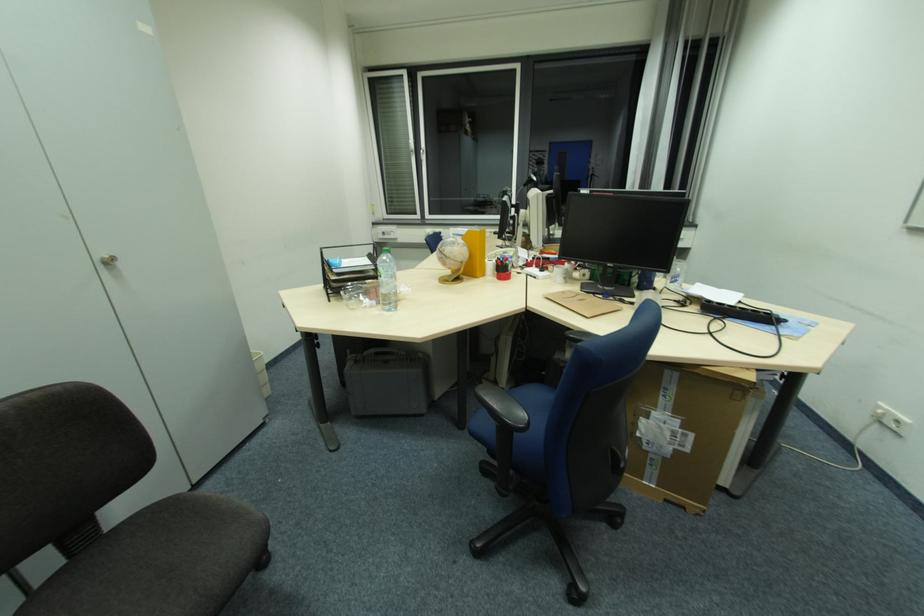
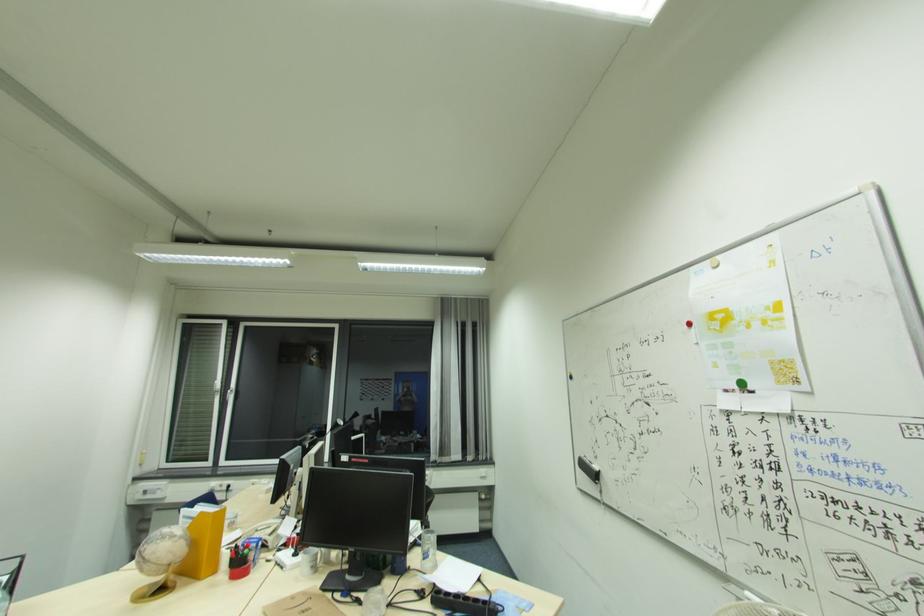
In the second image, find the point that corresponds to the point at 509,261 in the first image.

(250, 548)